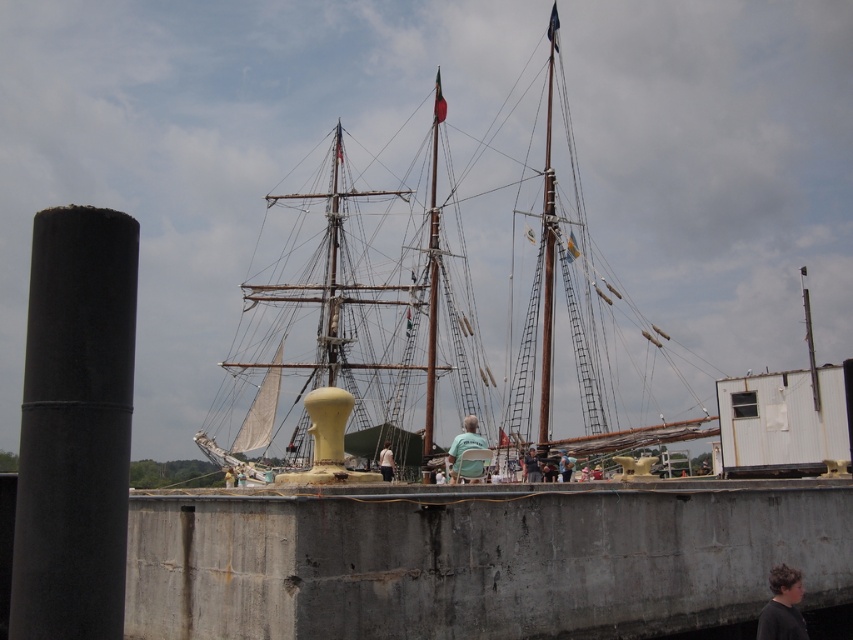
Can you confirm if wooden ship at center is wider than green fabric chair at center?

Yes.

Does wooden ship at center have a greater height compared to green fabric chair at center?

Indeed, wooden ship at center has a greater height compared to green fabric chair at center.

Between point (334, 339) and point (482, 445), which one is positioned in front?

Point (482, 445) is in front.

Where is `wooden ship at center`? The image size is (853, 640). wooden ship at center is located at coordinates (393, 289).

Does black matte cylinder at left have a smaller size compared to dark gray shirt at lower right?

Incorrect, black matte cylinder at left is not smaller in size than dark gray shirt at lower right.

Can you confirm if black matte cylinder at left is positioned above dark gray shirt at lower right?

Yes.

Who is more distant from viewer, (19, 490) or (786, 584)?

The point (786, 584) is more distant.

Locate an element on the screen. The height and width of the screenshot is (640, 853). black matte cylinder at left is located at coordinates (74, 426).

Who is positioned more to the right, dark gray shirt at lower right or blue denim shirt at center?

dark gray shirt at lower right

Is point (780, 636) less distant than point (538, 470)?

That is True.

Is point (786, 580) in front of point (540, 476)?

Yes, point (786, 580) is in front of point (540, 476).

The width and height of the screenshot is (853, 640). What are the coordinates of `dark gray shirt at lower right` in the screenshot? It's located at (782, 605).